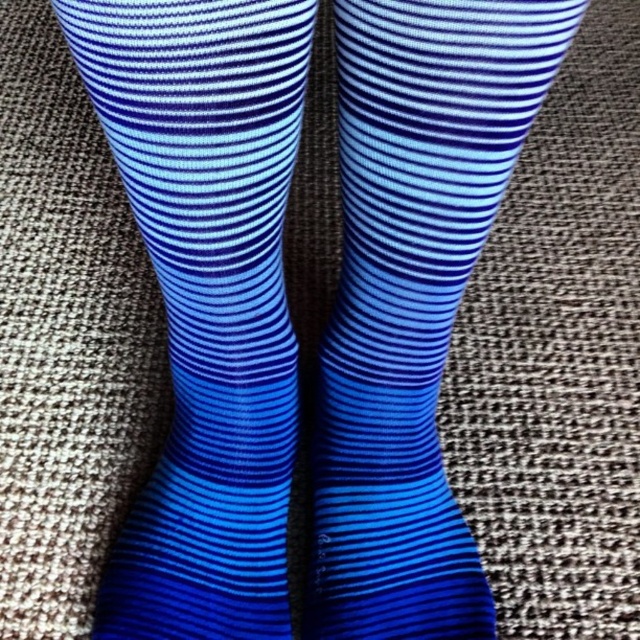
Question: Is blue striped sock at left bigger than blue ribbed sock at center?

Choices:
 (A) no
 (B) yes

Answer: (B)

Question: Among these points, which one is farthest from the camera?

Choices:
 (A) (362, 608)
 (B) (180, 17)

Answer: (A)

Question: Can you confirm if blue striped sock at left is bigger than blue ribbed sock at center?

Choices:
 (A) no
 (B) yes

Answer: (B)

Question: Which of the following is the farthest from the observer?

Choices:
 (A) blue striped sock at left
 (B) blue ribbed sock at center

Answer: (B)

Question: Is blue striped sock at left below blue ribbed sock at center?

Choices:
 (A) no
 (B) yes

Answer: (A)